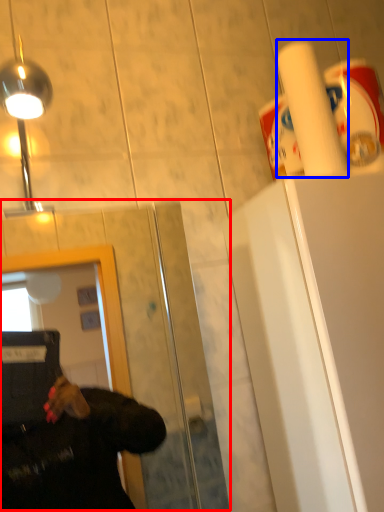
Question: Which object appears farthest to the camera in this image, glass door (highlighted by a red box) or paper towel (highlighted by a blue box)?

Choices:
 (A) glass door
 (B) paper towel

Answer: (B)